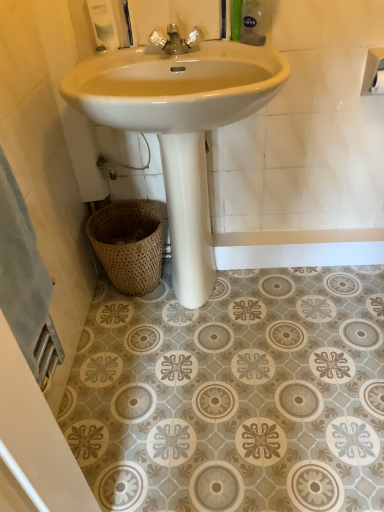
Image resolution: width=384 pixels, height=512 pixels. Find the location of `empty space that is to the right of chrome metallic faucet at center`. empty space that is to the right of chrome metallic faucet at center is located at coordinates (233, 50).